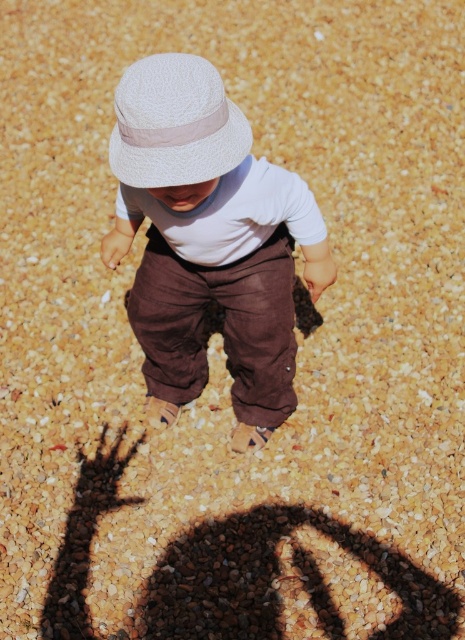
Is matte white hat at center positioned in front of white textured hat at upper center?

No, it is not.

Consider the image. Does matte white hat at center have a larger size compared to white textured hat at upper center?

Correct, matte white hat at center is larger in size than white textured hat at upper center.

Which is behind, point (280, 262) or point (144, 180)?

The point (280, 262) is behind.

The height and width of the screenshot is (640, 465). Find the location of `matte white hat at center`. matte white hat at center is located at coordinates (208, 243).